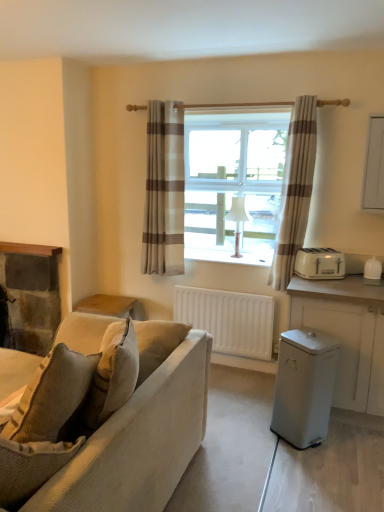
Question: Would you say beige striped curtain at center, the second curtain positioned from the right, is inside or outside white matte radiator at center?

Choices:
 (A) inside
 (B) outside

Answer: (B)

Question: Considering the positions of beige striped curtain at center, the second curtain positioned from the right, and white matte radiator at center in the image, is beige striped curtain at center, the second curtain positioned from the right, wider or thinner than white matte radiator at center?

Choices:
 (A) thin
 (B) wide

Answer: (B)

Question: Considering the real-world distances, which object is farthest from the white plastic trash can at lower right, arranged as the 1th appliance when viewed from the front?

Choices:
 (A) white plastic toaster at right, which appears as the 2th appliance when viewed from the front
 (B) textured beige couch at left
 (C) beige striped curtain at center, the second curtain positioned from the right
 (D) white matte radiator at center
 (E) beige striped curtain at center, marked as the first curtain in a right-to-left arrangement

Answer: (C)

Question: Which of these objects is positioned farthest from the textured beige couch at left?

Choices:
 (A) white plastic trash can at lower right, acting as the 2th appliance starting from the back
 (B) beige striped curtain at center, arranged as the first curtain when viewed from the left
 (C) white matte cabinet at right
 (D) beige striped curtain at center, marked as the first curtain in a right-to-left arrangement
 (E) white plastic toaster at right, placed as the 2th appliance when sorted from bottom to top

Answer: (B)